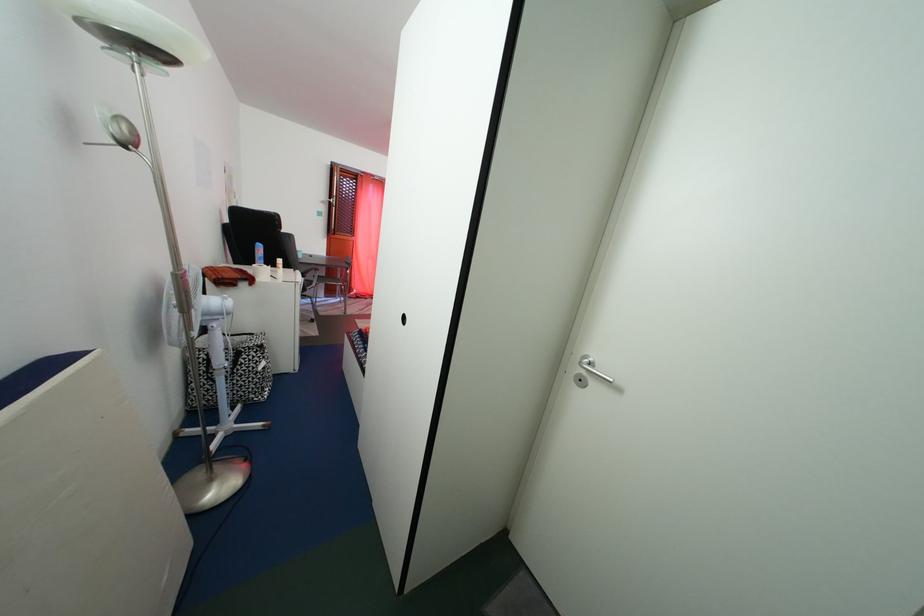
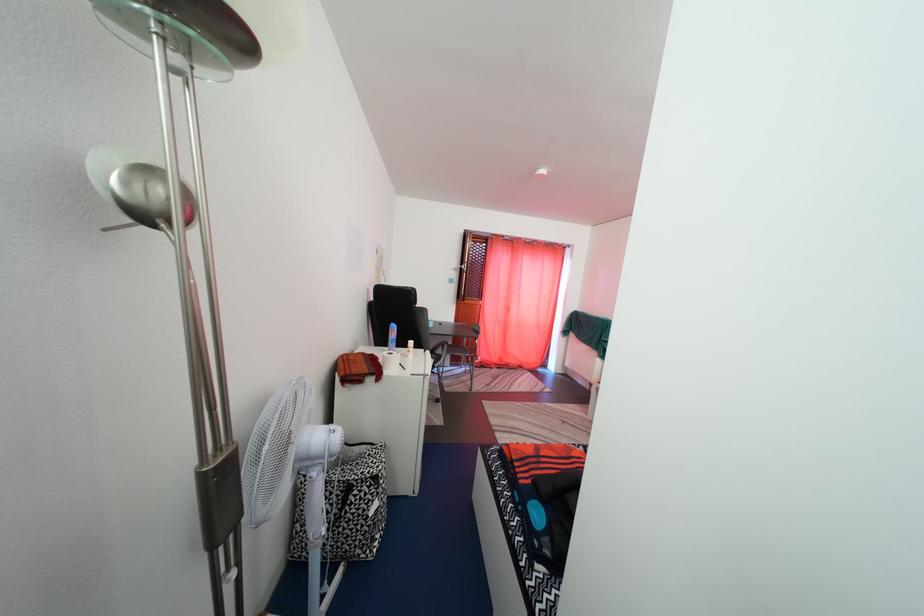
Locate, in the second image, the point that corresponds to point 339,203 in the first image.

(470, 270)